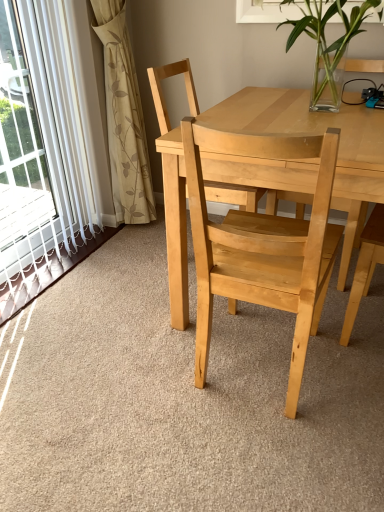
Locate an element on the screen. This screenshot has height=512, width=384. vacant region below clear glass vase at upper center (from a real-world perspective) is located at coordinates (325, 110).